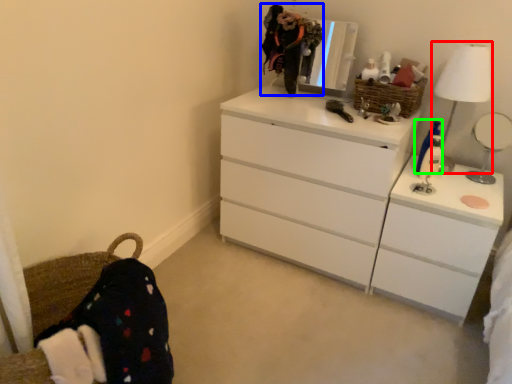
Question: Which object is the farthest from table lamp (highlighted by a red box)? Choose among these: selfie (highlighted by a blue box) or toy (highlighted by a green box).

Choices:
 (A) selfie
 (B) toy

Answer: (A)